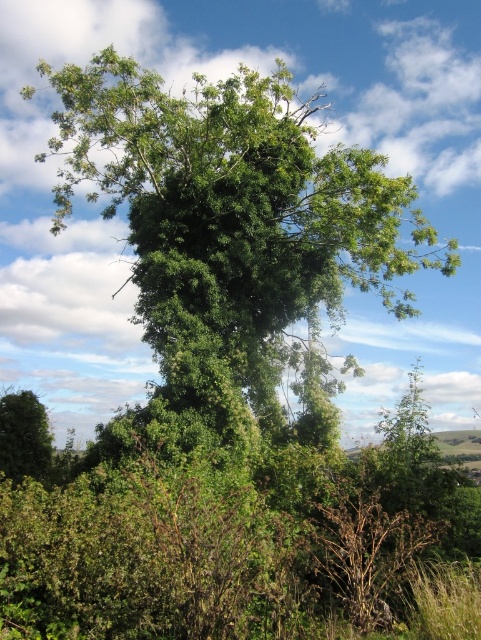
Question: Where is green leafy tree at center located in relation to green leafy tree at lower left in the image?

Choices:
 (A) left
 (B) right

Answer: (B)

Question: Which of the following is the farthest from the observer?

Choices:
 (A) (16, 424)
 (B) (165, 388)

Answer: (A)

Question: In this image, where is green leafy tree at center located relative to green leafy tree at lower left?

Choices:
 (A) right
 (B) left

Answer: (A)

Question: Is green leafy tree at center bigger than green leafy tree at lower left?

Choices:
 (A) yes
 (B) no

Answer: (A)